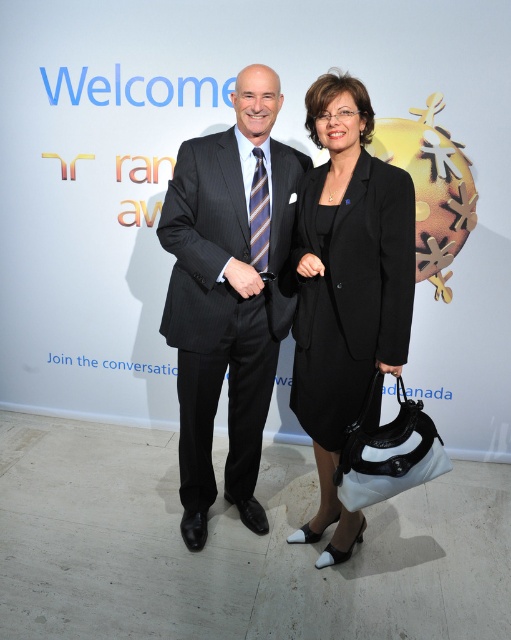
You are taking a photo of two people standing against a wall with text and a logo. You want to focus on the person closer to the camera. Which point should you focus on, point (179, 273) or point (364, 353)?

Point (179, 273) is further to the camera than point (364, 353), so you should focus on point (179, 273) to capture the person closer to the camera.